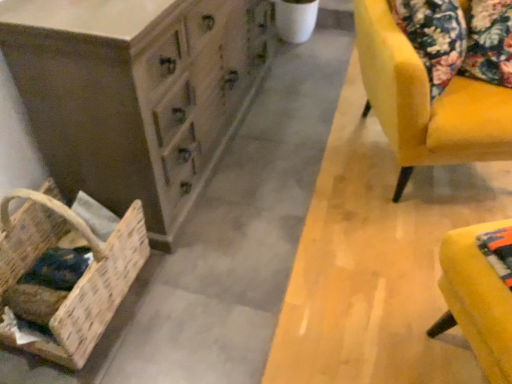
Question: Is wooden chest of drawers at lower left turned away from velvet yellow chair at right?

Choices:
 (A) no
 (B) yes

Answer: (A)

Question: Considering the relative sizes of wooden chest of drawers at lower left and velvet yellow chair at right in the image provided, is wooden chest of drawers at lower left taller than velvet yellow chair at right?

Choices:
 (A) yes
 (B) no

Answer: (A)

Question: Is velvet yellow chair at right located within wooden chest of drawers at lower left?

Choices:
 (A) no
 (B) yes

Answer: (A)

Question: Is wooden chest of drawers at lower left closer to the viewer compared to velvet yellow chair at right?

Choices:
 (A) no
 (B) yes

Answer: (B)

Question: Does wooden chest of drawers at lower left lie behind velvet yellow chair at right?

Choices:
 (A) no
 (B) yes

Answer: (A)

Question: Is velvet yellow chair at right taller or shorter than woven wood basket at lower left?

Choices:
 (A) tall
 (B) short

Answer: (A)

Question: Considering their positions, is velvet yellow chair at right located in front of or behind woven wood basket at lower left?

Choices:
 (A) behind
 (B) front

Answer: (A)

Question: From a real-world perspective, is velvet yellow chair at right above or below woven wood basket at lower left?

Choices:
 (A) above
 (B) below

Answer: (A)

Question: Considering the positions of velvet yellow chair at right and woven wood basket at lower left in the image, is velvet yellow chair at right bigger or smaller than woven wood basket at lower left?

Choices:
 (A) small
 (B) big

Answer: (B)

Question: From the image's perspective, is wooden chest of drawers at lower left positioned above or below woven wood basket at lower left?

Choices:
 (A) below
 (B) above

Answer: (B)

Question: Considering the positions of wooden chest of drawers at lower left and woven wood basket at lower left in the image, is wooden chest of drawers at lower left taller or shorter than woven wood basket at lower left?

Choices:
 (A) short
 (B) tall

Answer: (B)

Question: Relative to woven wood basket at lower left, is wooden chest of drawers at lower left in front or behind?

Choices:
 (A) behind
 (B) front

Answer: (A)

Question: Considering the positions of wooden chest of drawers at lower left and woven wood basket at lower left in the image, is wooden chest of drawers at lower left wider or thinner than woven wood basket at lower left?

Choices:
 (A) wide
 (B) thin

Answer: (A)

Question: Based on their sizes in the image, would you say velvet yellow chair at right is bigger or smaller than wooden chest of drawers at lower left?

Choices:
 (A) small
 (B) big

Answer: (B)

Question: Is velvet yellow chair at right taller or shorter than wooden chest of drawers at lower left?

Choices:
 (A) tall
 (B) short

Answer: (B)